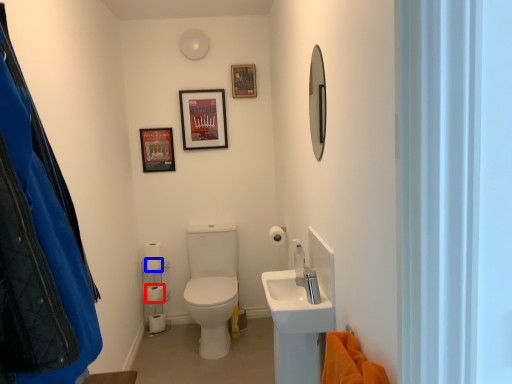
Question: Which of the following is the farthest to the observer, toilet paper (highlighted by a red box) or toilet paper (highlighted by a blue box)?

Choices:
 (A) toilet paper
 (B) toilet paper

Answer: (A)